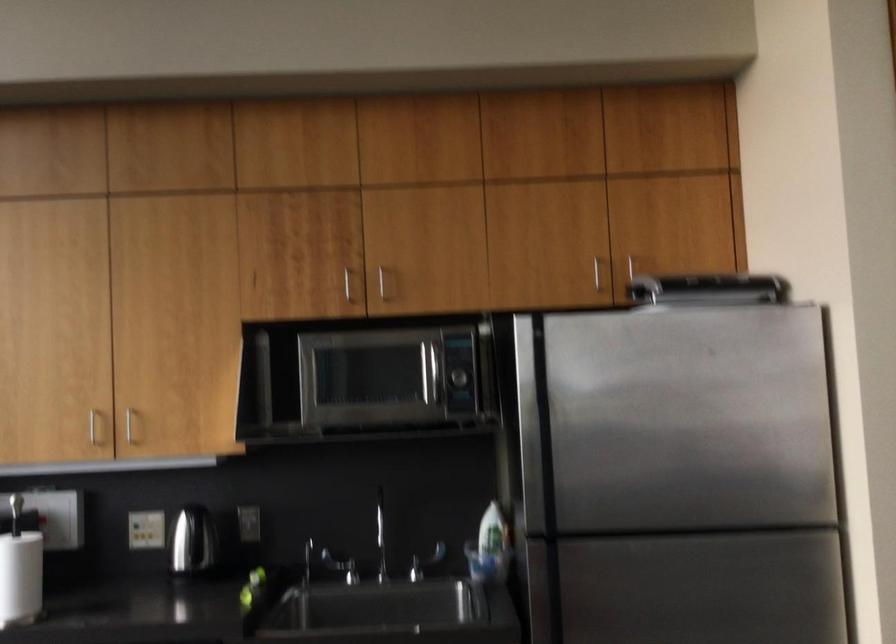
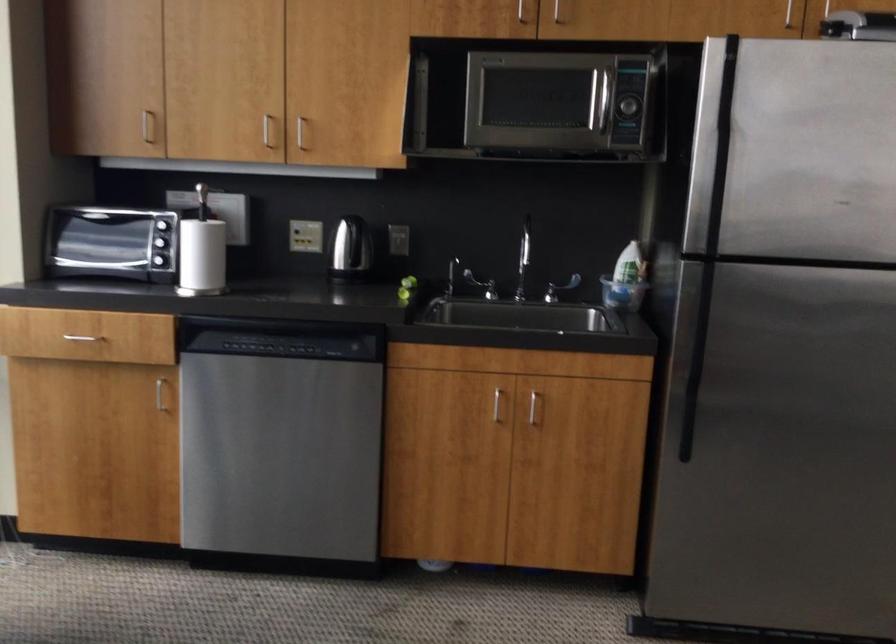
Where in the second image is the point corresponding to point (437, 375) from the first image?

(602, 106)